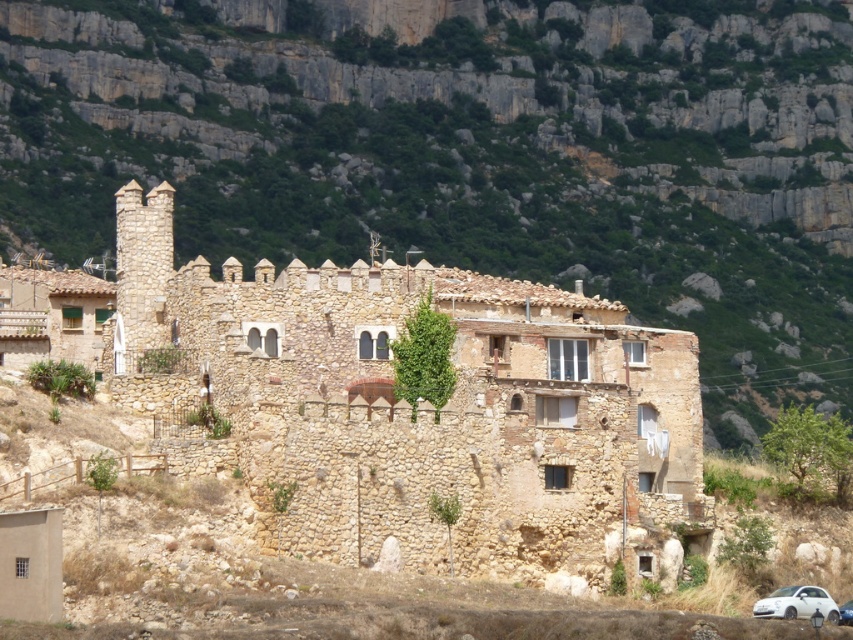
Which is behind, point (769, 115) or point (389, 298)?

Point (769, 115)

Does gray rocky mountain at upper center appear on the right side of brown stone fort at center?

Indeed, gray rocky mountain at upper center is positioned on the right side of brown stone fort at center.

Where is `gray rocky mountain at upper center`? gray rocky mountain at upper center is located at coordinates (473, 150).

Is brown stone fort at center to the right of metallic blue car at lower right from the viewer's perspective?

In fact, brown stone fort at center is to the left of metallic blue car at lower right.

Which is behind, point (451, 280) or point (840, 620)?

The point (451, 280) is behind.

You are a GUI agent. You are given a task and a screenshot of the screen. Output one action in this format:
    pyautogui.click(x=<x>, y=<y>)
    Task: Click on the brown stone fort at center
    The width and height of the screenshot is (853, 640).
    Given the screenshot: What is the action you would take?
    pyautogui.click(x=421, y=410)

Can you confirm if gray rocky mountain at upper center is positioned to the left of white matte car at lower right?

Correct, you'll find gray rocky mountain at upper center to the left of white matte car at lower right.

Which is behind, point (225, 104) or point (811, 608)?

The point (225, 104) is more distant.

In order to click on gray rocky mountain at upper center in this screenshot , I will do `click(473, 150)`.